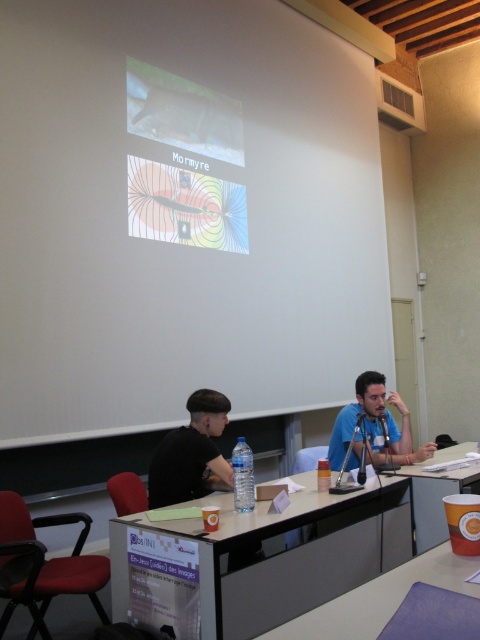
From the picture: You are standing at the entrance of the conference room. You need to place a small plant on the black glossy table at center. To do that, you must walk towards the table. Which direction should you walk from the entrance?

Since the black glossy table at center is located at point 0.870 on the x axis and 0.583 on the y axis, you should walk towards the center of the room to reach it.

You are sitting in the conference room and want to look at the projector screen without moving your head. Which object is closer to you, the matte plastic projector screen at upper center or the black matte shirt at lower left?

The matte plastic projector screen at upper center is closer to you than the black matte shirt at lower left.

You are standing at the entrance of the conference room and want to greet the person wearing the blue matte shirt at center. Which direction should you walk to reach them?

The blue matte shirt at center is located at point 0.666 on the x and 0.783 on the y. Since you are at the entrance, you should walk towards the center of the room to reach them.